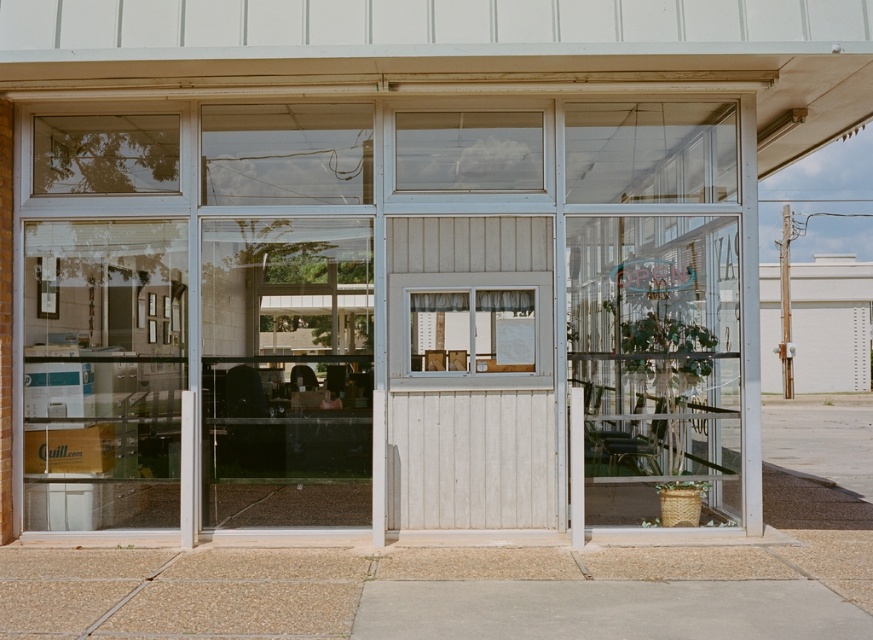
Does clear glass door at center have a lesser height compared to matte white window at center?

No.

You are a GUI agent. You are given a task and a screenshot of the screen. Output one action in this format:
    pyautogui.click(x=<x>, y=<y>)
    Task: Click on the clear glass door at center
    Image resolution: width=873 pixels, height=640 pixels.
    Given the screenshot: What is the action you would take?
    pyautogui.click(x=656, y=365)

Which is in front, point (710, 381) or point (432, 346)?

Positioned in front is point (432, 346).

Identify the location of clear glass door at center. The height and width of the screenshot is (640, 873). (656, 365).

Based on the photo, does clear glass door at center have a lesser width compared to transparent glass window at center?

No.

Can you confirm if clear glass door at center is positioned below transparent glass window at center?

Indeed, clear glass door at center is positioned under transparent glass window at center.

Between point (713, 336) and point (512, 163), which one is positioned behind?

The point (713, 336) is more distant.

Identify the location of clear glass door at center. (656, 365).

Who is shorter, transparent glass door at center or clear glass door at center?

clear glass door at center

Does transparent glass door at center appear on the right side of clear glass door at center?

No, transparent glass door at center is not to the right of clear glass door at center.

Between point (361, 284) and point (593, 413), which one is positioned behind?

Positioned behind is point (361, 284).

The image size is (873, 640). In order to click on transparent glass door at center in this screenshot , I will do `click(286, 371)`.